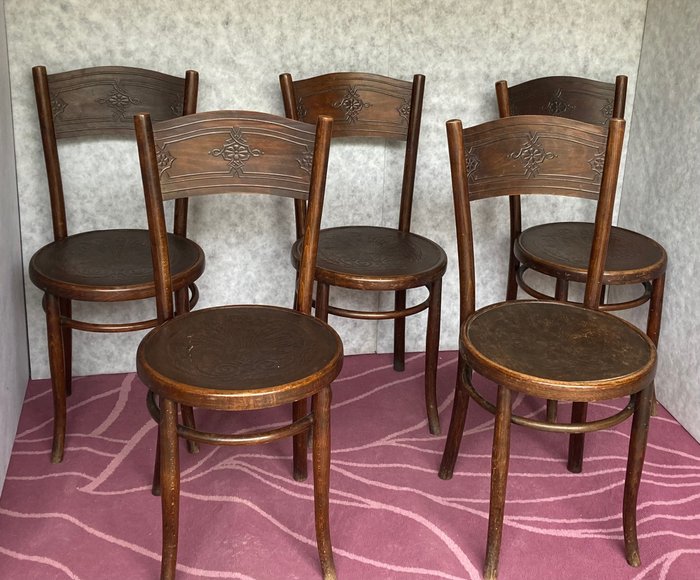
Image resolution: width=700 pixels, height=580 pixels. In order to click on backrest of chair in this screenshot , I will do `click(111, 92)`, `click(214, 146)`, `click(357, 99)`, `click(549, 155)`, `click(575, 99)`.